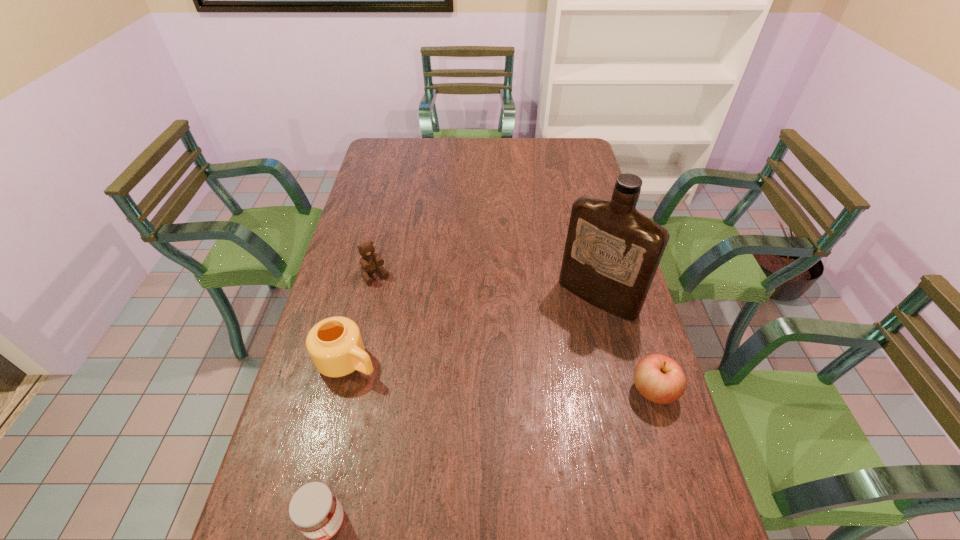
This screenshot has width=960, height=540. I want to click on blank area in the image that satisfies the following two spatial constraints: 1. on the front side of the tallest object; 2. on the right side of the apple, so click(x=620, y=390).